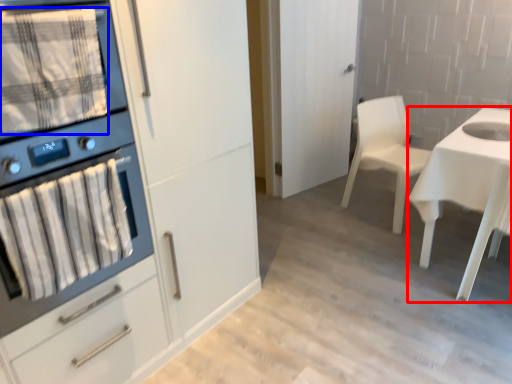
Question: Which of the following is the closest to the observer, desk (highlighted by a red box) or blanket (highlighted by a blue box)?

Choices:
 (A) desk
 (B) blanket

Answer: (B)